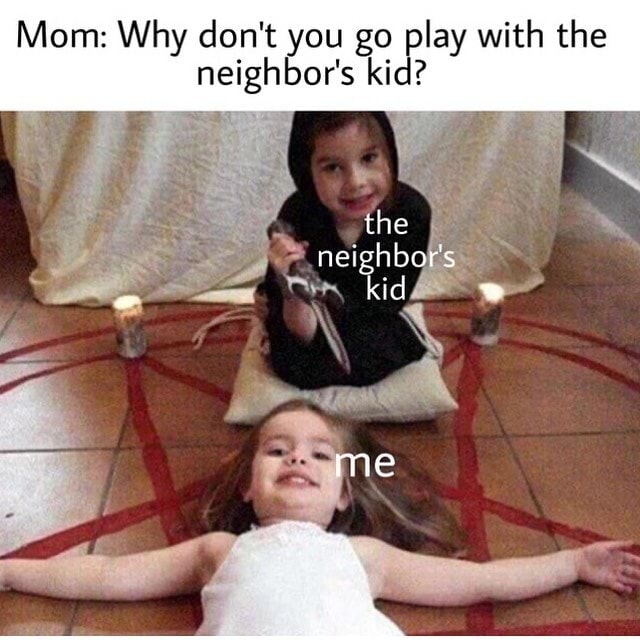
Locate an element on the screen. floor is located at coordinates (588, 454).